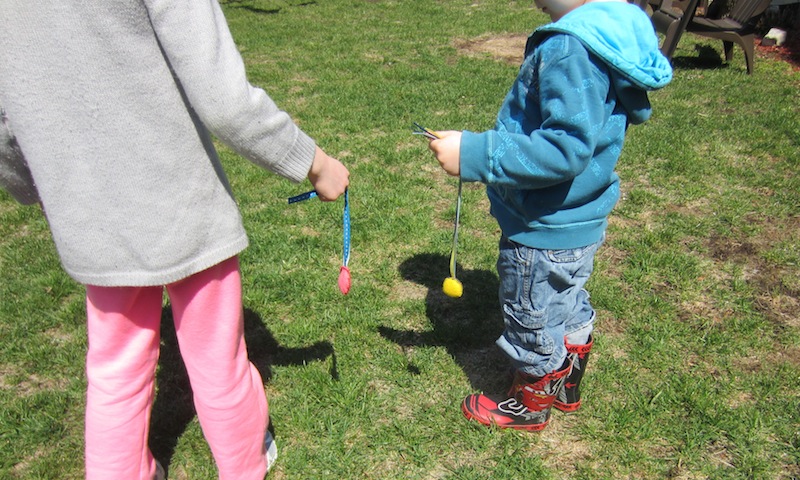
This screenshot has height=480, width=800. I want to click on toys, so click(x=342, y=285), click(x=454, y=288).